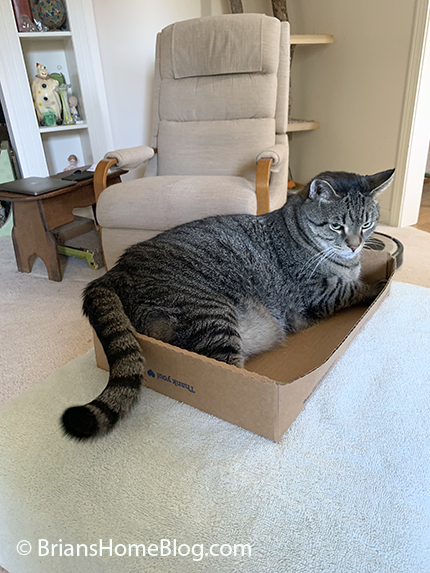
Where is `cardboard box`? This screenshot has height=573, width=430. cardboard box is located at coordinates (233, 395).